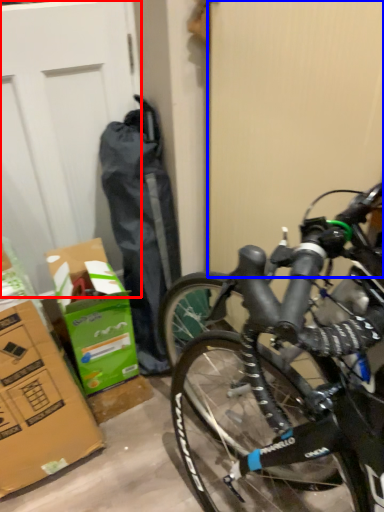
Question: Which point is further to the camera, garage door (highlighted by a red box) or screen door (highlighted by a blue box)?

Choices:
 (A) garage door
 (B) screen door

Answer: (A)